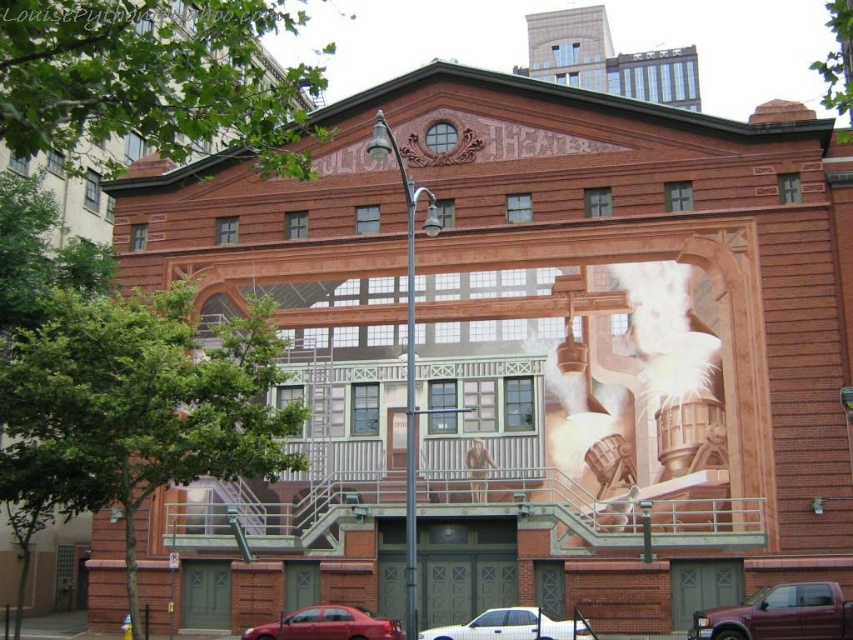
You are parking your car in the parking lot in front of the theater. You have a car that is 1.8 meters wide. The parking space is 2 meters wide. You see a shiny red sedan at lower center and a white glossy car at lower center. Can you fit your car into the space without touching either car?

The shiny red sedan at lower center might be wider than white glossy car at lower center. Since the parking space is 2 meters wide and your car is 1.8 meters wide, there is 0.2 meters of extra space. If the shiny red sedan at lower center is wider, it could potentially take up more space, but since the exact width isn not provided, it is uncertain whether there will be enough space. You should check the width of the shiny red sedan at lower center before deciding.

You are standing in front of the theater building and want to take a photo of the mural. There is a metallic maroon pickup truck at lower right that might block your view. Where exactly is the truck positioned relative to the mural?

The metallic maroon pickup truck at lower right is located at point (779,614), which is near the bottom right corner of the image, so it might be blocking the lower right portion of the mural if positioned too close.

You are a delivery driver who needs to park your vehicle in the parking lot behind the theater. The parking spaces are designed to accommodate vehicles up to the height of the white glossy car at lower center. Can your shiny red sedan at lower center fit into these spaces without any issues?

The shiny red sedan at lower center is not as tall as the white glossy car at lower center. Since the parking spaces are designed for vehicles up to the height of the white glossy car at lower center, the shiny red sedan at lower center should fit without any issues as it is shorter in height.